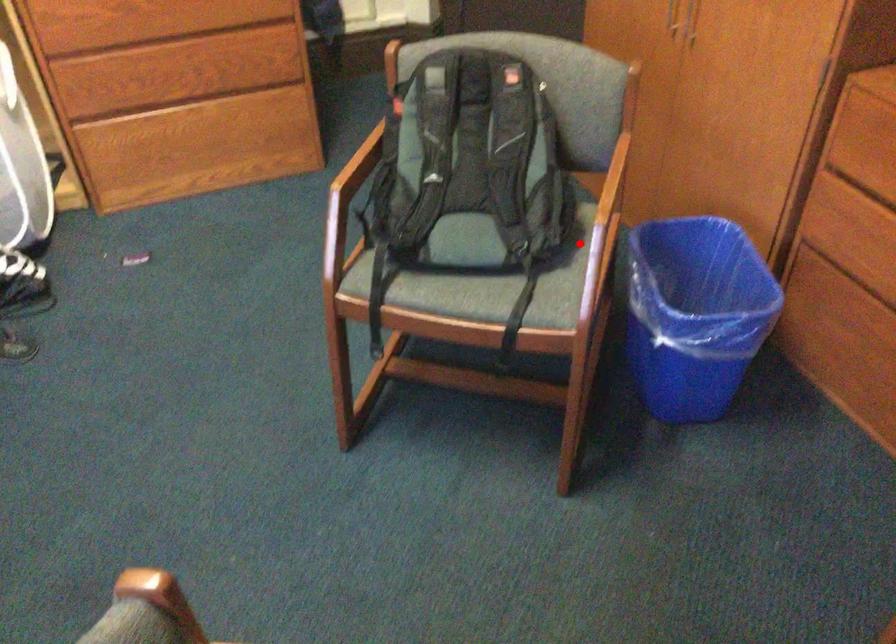
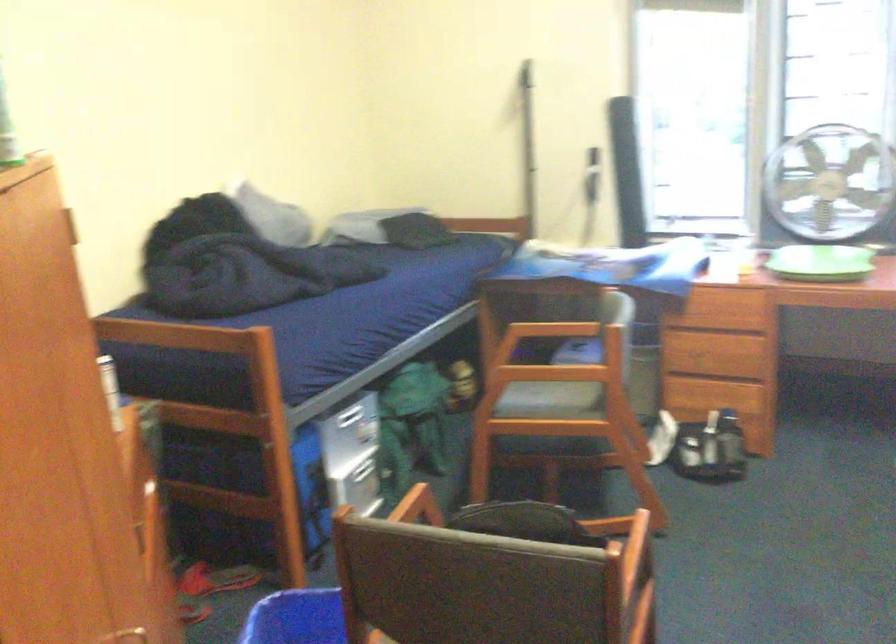
Where in the second image is the point corresponding to the highlighted location from the first image?

(418, 506)